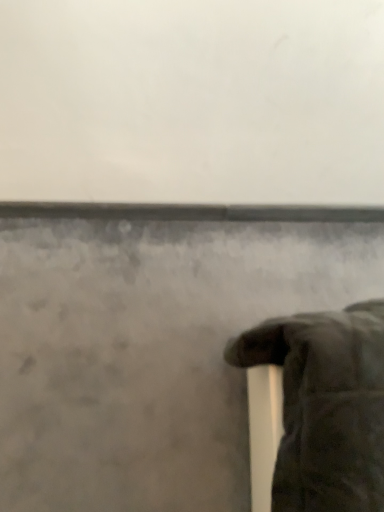
Question: Should I look upward or downward to see matte gray wall at lower left?

Choices:
 (A) down
 (B) up

Answer: (A)